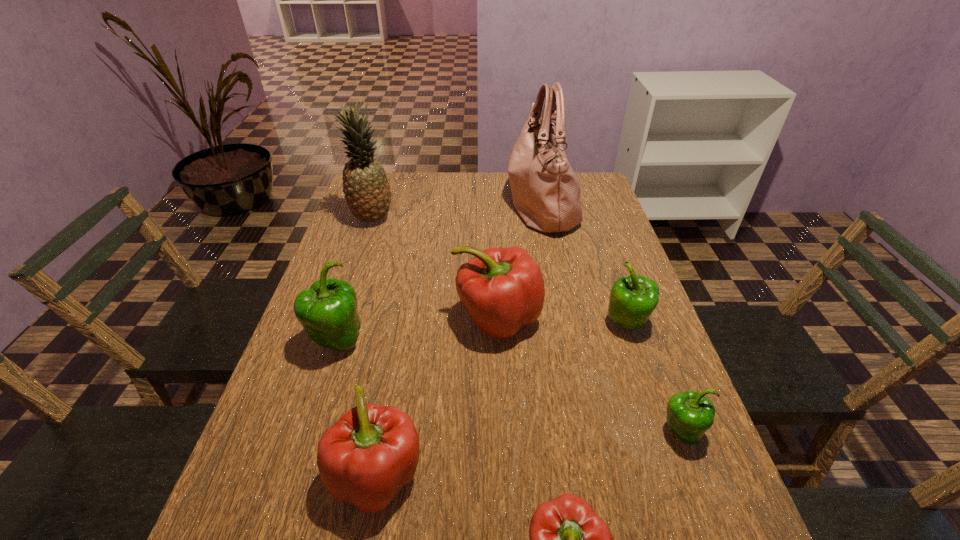
This screenshot has width=960, height=540. I want to click on free space between the leftmost green bell pepper and the smallest green bell pepper, so click(509, 387).

The height and width of the screenshot is (540, 960). What are the coordinates of `object that is the third closest to the pineapple` in the screenshot? It's located at (327, 311).

Where is `the seventh closest object to the nearest green bell pepper`? Image resolution: width=960 pixels, height=540 pixels. the seventh closest object to the nearest green bell pepper is located at coordinates (367, 191).

Locate which bell pepper is the second closest to the second smallest pink bell pepper. Please provide its 2D coordinates. Your answer should be formatted as a tuple, i.e. [(x, y)], where the tuple contains the x and y coordinates of a point satisfying the conditions above.

[(568, 539)]

Locate which bell pepper ranks second in proximity to the pineapple. Please provide its 2D coordinates. Your answer should be formatted as a tuple, i.e. [(x, y)], where the tuple contains the x and y coordinates of a point satisfying the conditions above.

[(327, 311)]

Select which green bell pepper is the closest to the pineapple. Please provide its 2D coordinates. Your answer should be formatted as a tuple, i.e. [(x, y)], where the tuple contains the x and y coordinates of a point satisfying the conditions above.

[(327, 311)]

Locate which green bell pepper is the closest to the leftmost green bell pepper. Please provide its 2D coordinates. Your answer should be formatted as a tuple, i.e. [(x, y)], where the tuple contains the x and y coordinates of a point satisfying the conditions above.

[(633, 299)]

In order to click on pink bell pepper that is the second closest to the farthest pink bell pepper in this screenshot , I will do `click(568, 539)`.

Select which pink bell pepper appears as the third closest to the leftmost green bell pepper. Please provide its 2D coordinates. Your answer should be formatted as a tuple, i.e. [(x, y)], where the tuple contains the x and y coordinates of a point satisfying the conditions above.

[(568, 539)]

You are a GUI agent. You are given a task and a screenshot of the screen. Output one action in this format:
    pyautogui.click(x=<x>, y=<y>)
    Task: Click on the vacant area in the image that satisfies the following two spatial constraints: 1. on the back side of the leftmost green bell pepper; 2. on the right side of the biggest pink bell pepper
    This screenshot has height=540, width=960.
    Given the screenshot: What is the action you would take?
    [x=345, y=319]